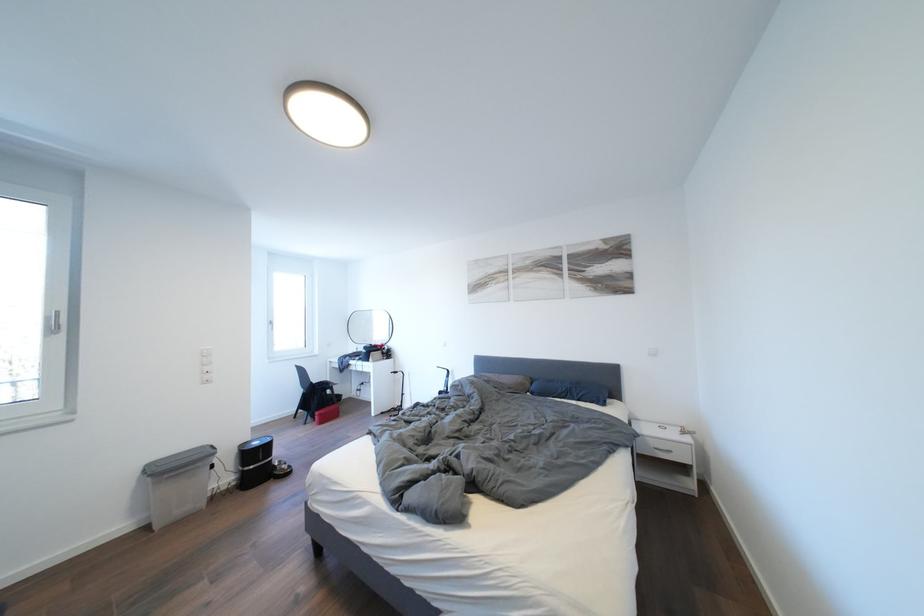
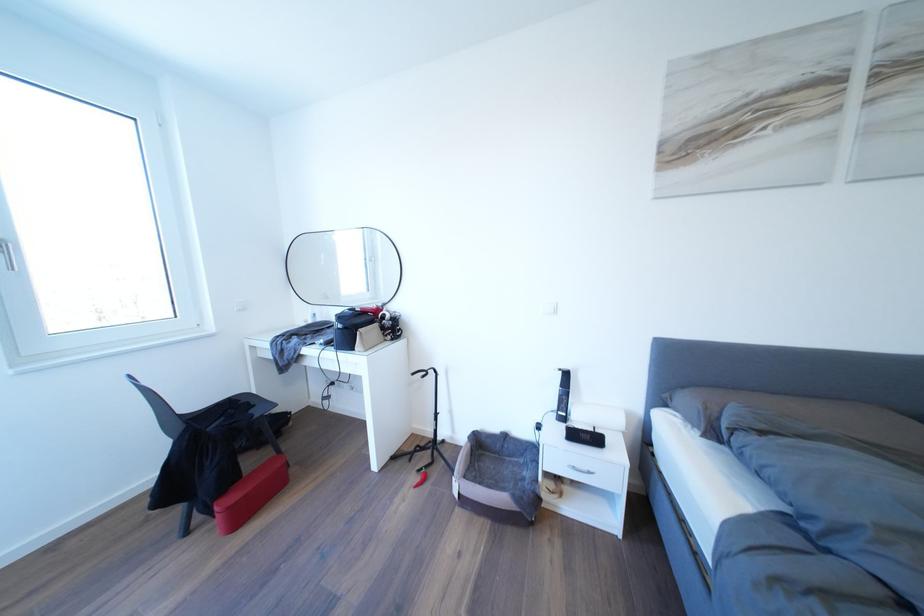
Locate, in the second image, the point that corresponds to point 359,354 in the first image.

(310, 322)